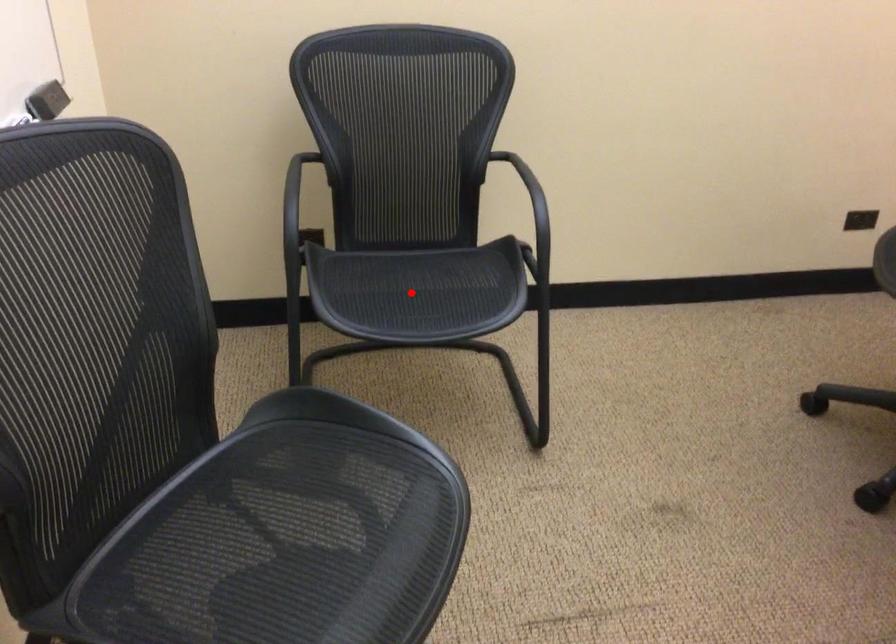
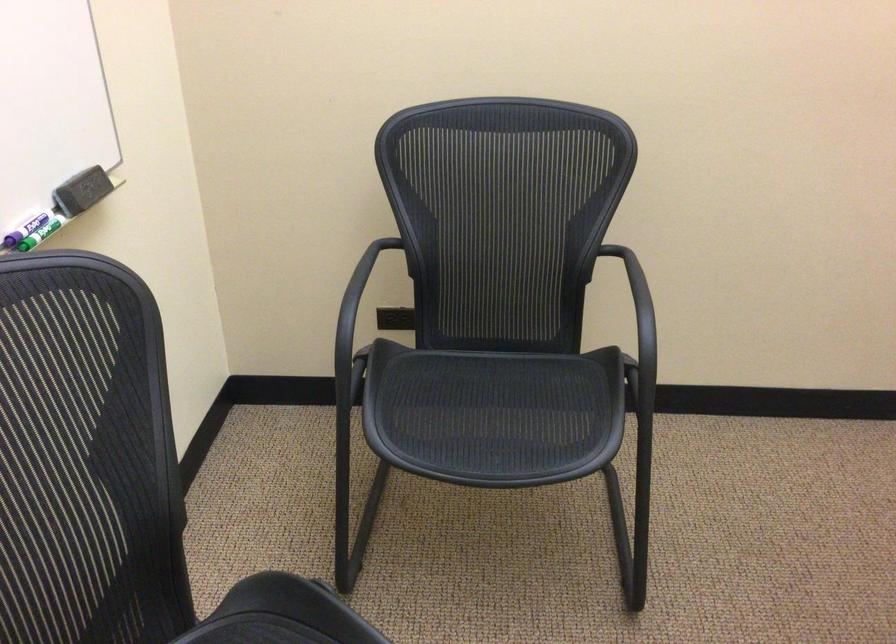
Question: I am providing you with two images of the same scene from different viewpoints. Given a red point in image1, look at the same physical point in image2. Is it:

Choices:
 (A) Closer to the viewpoint
 (B) Farther from the viewpoint

Answer: (A)